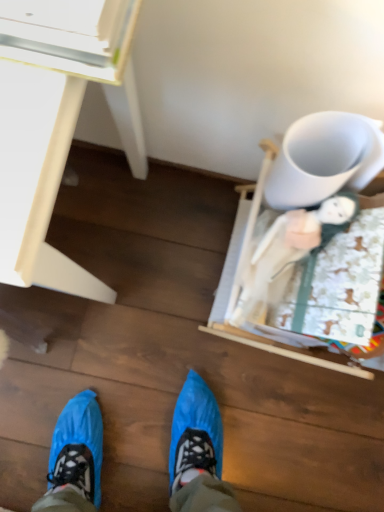
Find the location of a particular element. The image size is (384, 512). free spot in front of white matte mug at upper right is located at coordinates (266, 272).